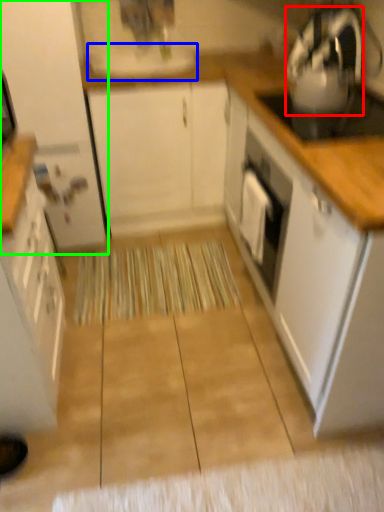
Question: Considering the real-world distances, which object is farthest from kitchen appliance (highlighted by a red box)? sink (highlighted by a blue box) or cabinetry (highlighted by a green box)?

Choices:
 (A) sink
 (B) cabinetry

Answer: (B)